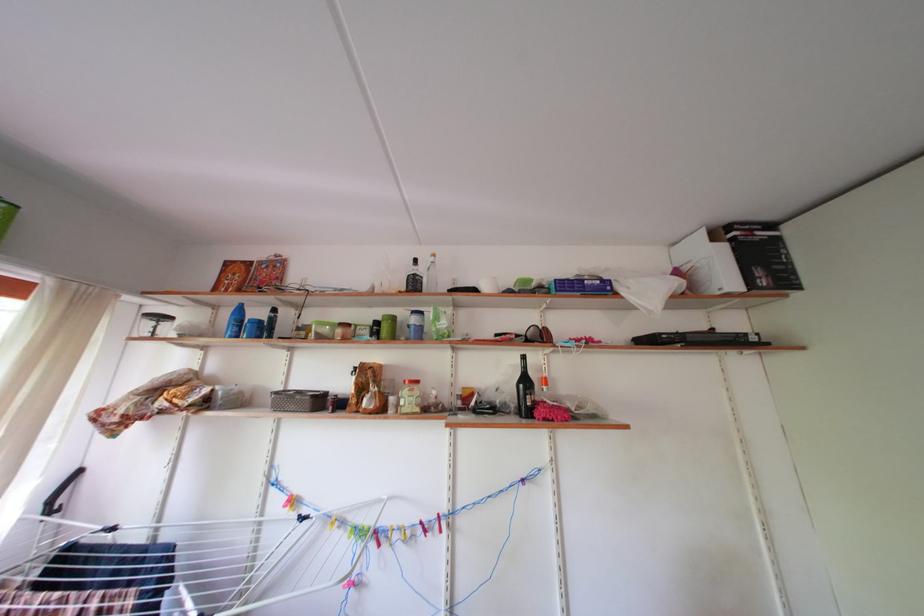
Describe the element at coordinates (761, 256) in the screenshot. The height and width of the screenshot is (616, 924). I see `the black cardboard box` at that location.